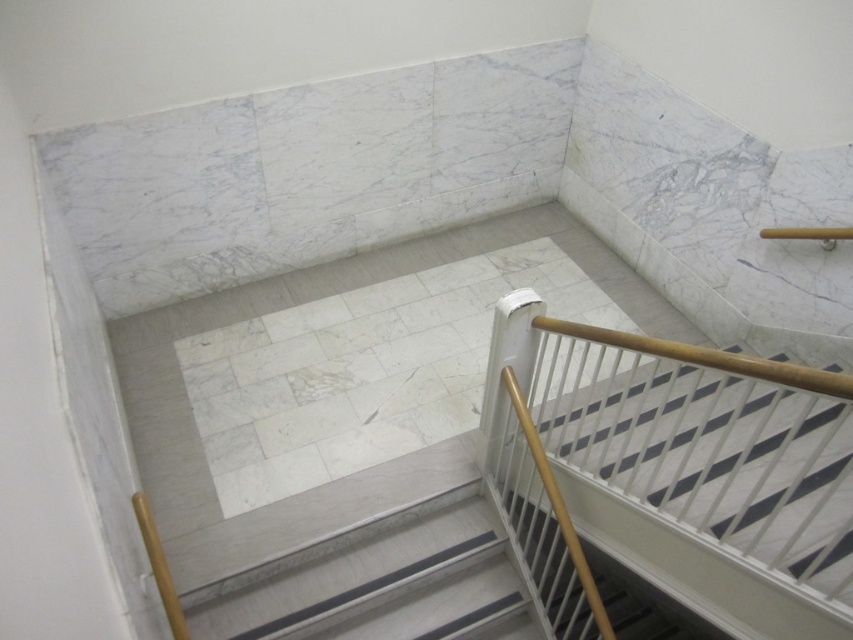
You are designing a renovation plan for the staircase and need to choose materials. The white plastic railing at lower right and the white marble stairs at center are both candidates. Considering their sizes, which one might be more suitable for a space that requires larger components?

The white plastic railing at lower right has a larger size compared to the white marble stairs at center, so it would be more suitable for a space that requires larger components.

You are standing on the landing area of the staircase and want to move towards the white plastic railing at lower right. Which direction should you walk relative to the white marble stairs at center?

You should walk to the right of the white marble stairs at center to reach the white plastic railing at lower right since the white plastic railing at lower right is located to the right of the white marble stairs at center.

You are standing on the landing of the staircase and want to grab the white plastic railing at lower right to steady yourself while walking down the white marble stairs at center. Can you reach the railing without bending down?

The white plastic railing at lower right has a greater height compared to white marble stairs at center, so you can reach it without bending down since it is taller than the stairs.